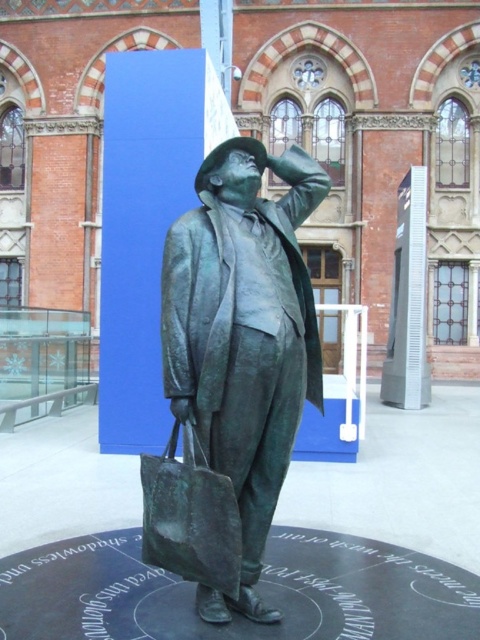
Question: Which object is closer to the camera taking this photo?

Choices:
 (A) bronze statue at center
 (B) green patina bag at center

Answer: (B)

Question: Is bronze statue at center smaller than green patina bag at center?

Choices:
 (A) yes
 (B) no

Answer: (B)

Question: Does bronze statue at center appear over green patina bag at center?

Choices:
 (A) no
 (B) yes

Answer: (B)

Question: Which point is farther to the camera?

Choices:
 (A) bronze statue at center
 (B) green patina bag at center

Answer: (A)

Question: Can you confirm if bronze statue at center is positioned to the right of green patina bag at center?

Choices:
 (A) no
 (B) yes

Answer: (B)